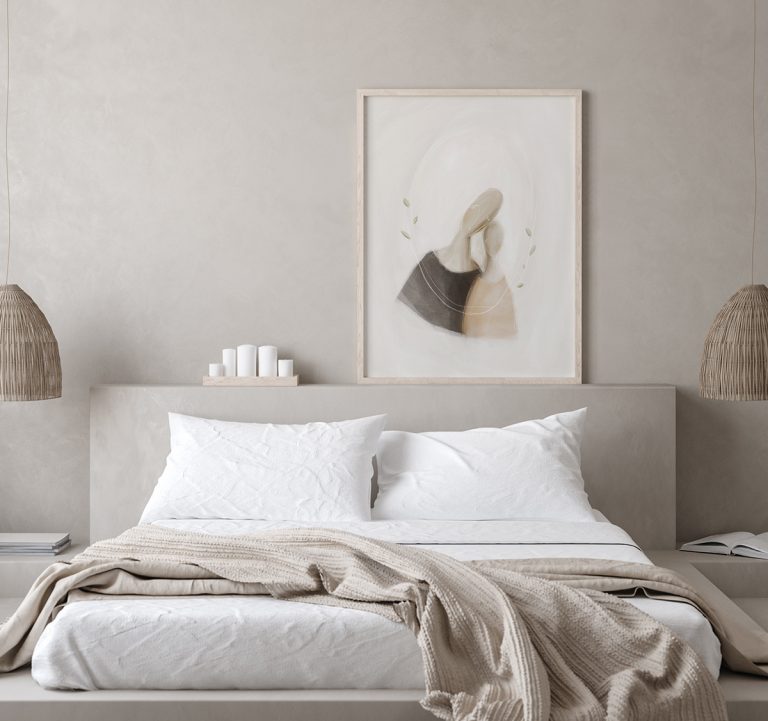
The image size is (768, 721). Find the location of `candles`. candles is located at coordinates (213, 371), (230, 357), (243, 358), (266, 362), (283, 367).